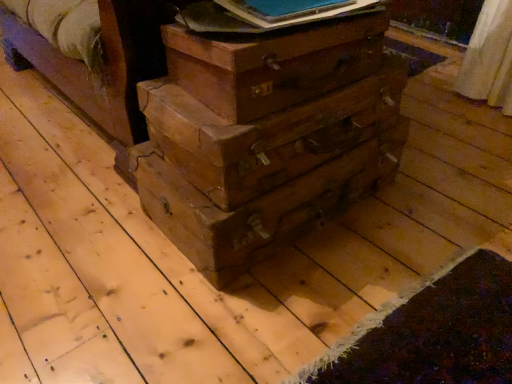
You are a GUI agent. You are given a task and a screenshot of the screen. Output one action in this format:
    pyautogui.click(x=<x>, y=<y>)
    Task: Click on the free space in front of wooden drawer at center, placed as the second drawer when sorted from top to bottom
    This screenshot has width=512, height=384.
    Given the screenshot: What is the action you would take?
    pyautogui.click(x=285, y=315)